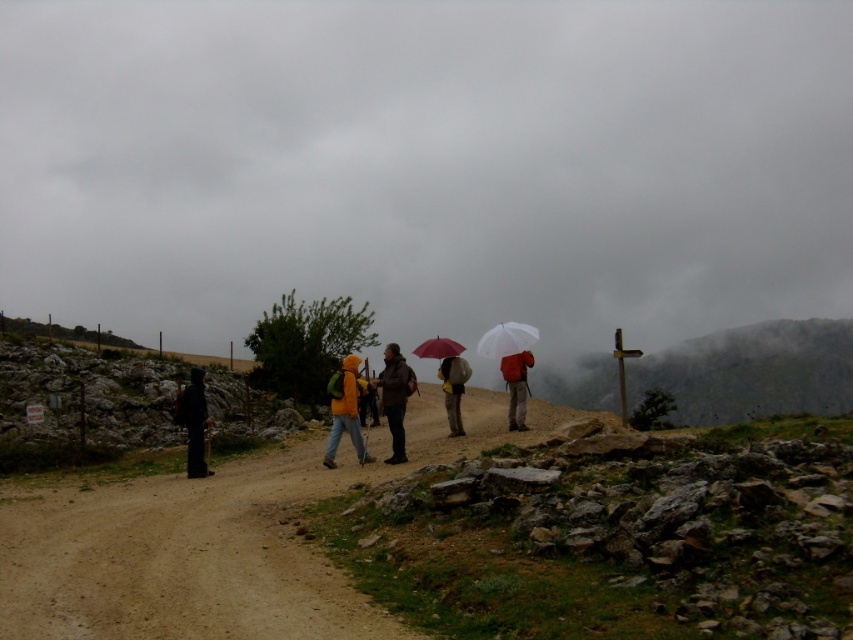
Does orange waterproof jacket at center have a larger size compared to transparent plastic umbrella at center?

No.

Who is shorter, orange waterproof jacket at center or transparent plastic umbrella at center?

Standing shorter between the two is orange waterproof jacket at center.

Does point (331, 433) lie in front of point (495, 344)?

Yes, point (331, 433) is in front of point (495, 344).

Locate an element on the screen. orange waterproof jacket at center is located at coordinates (347, 413).

What do you see at coordinates (395, 397) in the screenshot? The width and height of the screenshot is (853, 640). I see `brown leather jacket at center` at bounding box center [395, 397].

Which is below, brown leather jacket at center or black matte jacket at left?

black matte jacket at left is below.

Between point (387, 348) and point (186, 404), which one is positioned in front?

Point (186, 404) is in front.

What are the coordinates of `brown leather jacket at center` in the screenshot? It's located at (395, 397).

Measure the distance from cloudy gray sky at upper center to transparent plastic umbrella at center.

A distance of 130.51 meters exists between cloudy gray sky at upper center and transparent plastic umbrella at center.

Which is below, cloudy gray sky at upper center or transparent plastic umbrella at center?

Positioned lower is transparent plastic umbrella at center.

Is point (663, 326) farther from camera compared to point (520, 352)?

Yes, it is behind point (520, 352).

I want to click on cloudy gray sky at upper center, so click(426, 164).